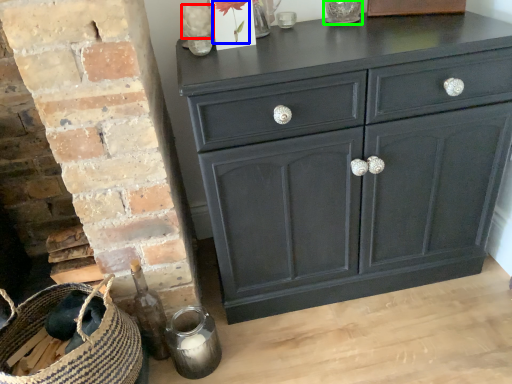
Question: Which object is positioned closest to flower (highlighted by a red box)? Select from flower (highlighted by a blue box) and glass vase (highlighted by a green box).

Choices:
 (A) flower
 (B) glass vase

Answer: (A)